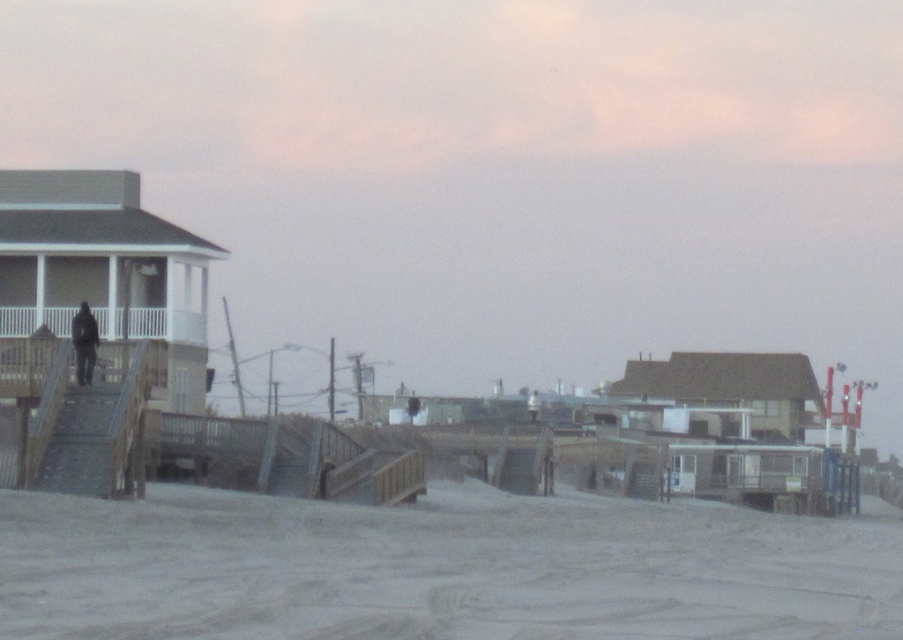
Question: Can you confirm if sandy beach at lower left is wider than dark gray fabric jacket at left?

Choices:
 (A) no
 (B) yes

Answer: (B)

Question: Is metallic gray stairs at left to the left of dark gray fabric jacket at left from the viewer's perspective?

Choices:
 (A) yes
 (B) no

Answer: (B)

Question: Which object appears closest to the camera in this image?

Choices:
 (A) sandy beach at lower left
 (B) metallic gray stairs at left

Answer: (A)

Question: Where is sandy beach at lower left located in relation to metallic gray stairs at left in the image?

Choices:
 (A) right
 (B) left

Answer: (A)

Question: Estimate the real-world distances between objects in this image. Which object is farther from the sandy beach at lower left?

Choices:
 (A) metallic gray stairs at left
 (B) dark gray fabric jacket at left

Answer: (B)

Question: Considering the real-world distances, which object is closest to the sandy beach at lower left?

Choices:
 (A) dark gray fabric jacket at left
 (B) metallic gray stairs at left

Answer: (B)